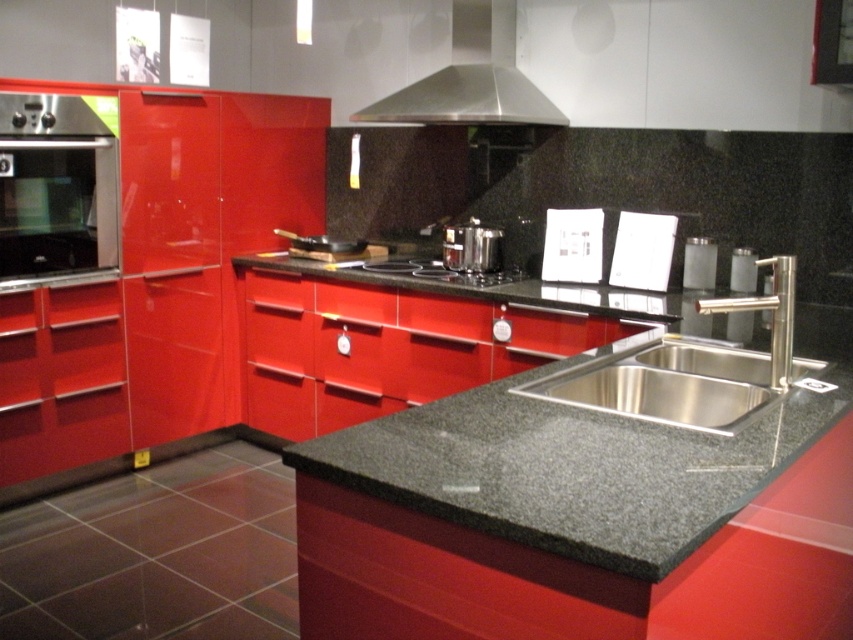
Which is more to the right, stainless steel sink at center or satin silver exhaust hood at upper center?

From the viewer's perspective, stainless steel sink at center appears more on the right side.

The width and height of the screenshot is (853, 640). What are the coordinates of `stainless steel sink at center` in the screenshot? It's located at (691, 369).

Locate an element on the screen. stainless steel sink at center is located at coordinates (691, 369).

Where is `stainless steel sink at center`? The height and width of the screenshot is (640, 853). stainless steel sink at center is located at coordinates (691, 369).

Is stainless steel sink at center to the left of polished stainless steel faucet at sink right from the viewer's perspective?

Yes, stainless steel sink at center is to the left of polished stainless steel faucet at sink right.

Who is lower down, stainless steel sink at center or polished stainless steel faucet at sink right?

Positioned lower is stainless steel sink at center.

Does point (651, 380) come behind point (782, 360)?

Yes, it is behind point (782, 360).

The height and width of the screenshot is (640, 853). I want to click on stainless steel sink at center, so click(691, 369).

Does point (659, 324) come behind point (544, 115)?

No, (659, 324) is in front of (544, 115).

Can you confirm if granite countertop at center is bigger than satin silver exhaust hood at upper center?

Indeed, granite countertop at center has a larger size compared to satin silver exhaust hood at upper center.

You are a GUI agent. You are given a task and a screenshot of the screen. Output one action in this format:
    pyautogui.click(x=<x>, y=<y>)
    Task: Click on the granite countertop at center
    This screenshot has height=640, width=853.
    Given the screenshot: What is the action you would take?
    point(556,410)